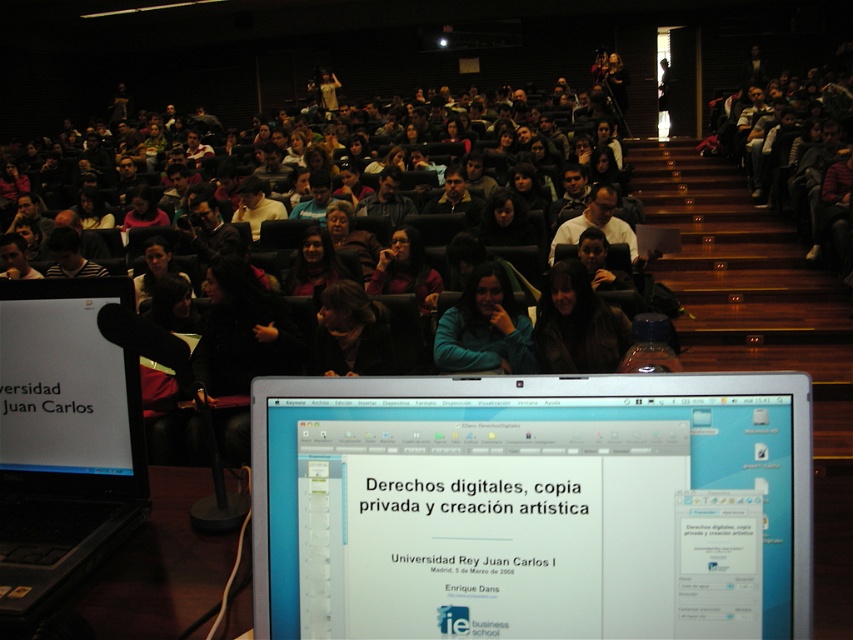
Does black matte laptop at left have a larger size compared to matte black hair at center?

No, black matte laptop at left is not bigger than matte black hair at center.

Is black matte laptop at left closer to camera compared to matte black hair at center?

Yes, black matte laptop at left is closer to the viewer.

The height and width of the screenshot is (640, 853). Describe the element at coordinates (62, 440) in the screenshot. I see `black matte laptop at left` at that location.

Where is `black matte laptop at left`? The width and height of the screenshot is (853, 640). black matte laptop at left is located at coordinates (62, 440).

Between dark brown fur coat at center and matte black hair at center, which one has less height?

Standing shorter between the two is matte black hair at center.

Image resolution: width=853 pixels, height=640 pixels. Describe the element at coordinates (577, 324) in the screenshot. I see `dark brown fur coat at center` at that location.

You are a GUI agent. You are given a task and a screenshot of the screen. Output one action in this format:
    pyautogui.click(x=<x>, y=<y>)
    Task: Click on the dark brown fur coat at center
    The image size is (853, 640).
    Given the screenshot: What is the action you would take?
    pyautogui.click(x=577, y=324)

Which is more to the left, silver metallic laptop at center or dark brown fur coat at center?

silver metallic laptop at center is more to the left.

Is point (456, 438) positioned behind point (576, 289)?

No, (456, 438) is in front of (576, 289).

Identify the location of silver metallic laptop at center. The height and width of the screenshot is (640, 853). (532, 506).